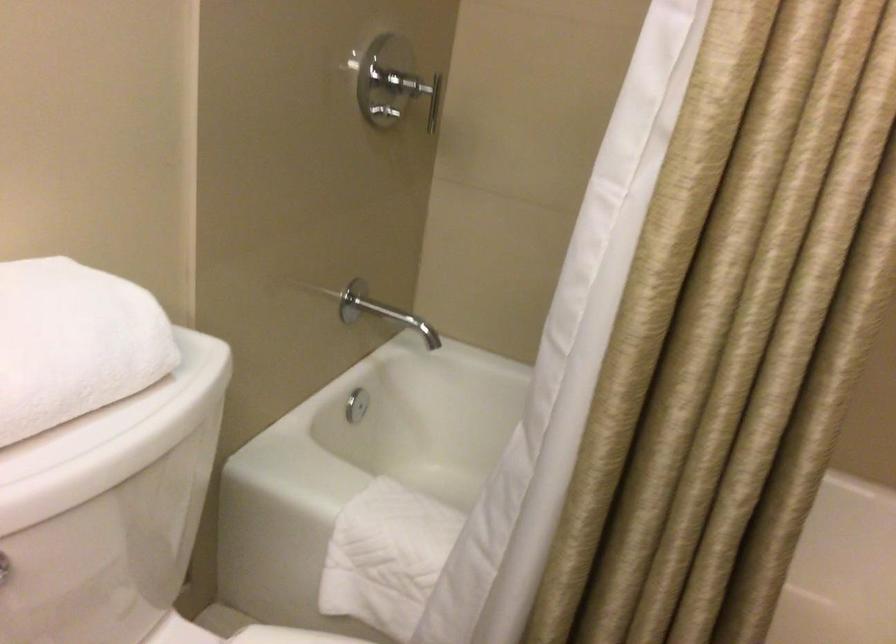
You are a GUI agent. You are given a task and a screenshot of the screen. Output one action in this format:
    pyautogui.click(x=<x>, y=<y>)
    Task: Click on the faucet diverter knob
    This screenshot has width=896, height=644.
    Given the screenshot: What is the action you would take?
    pyautogui.click(x=356, y=404)